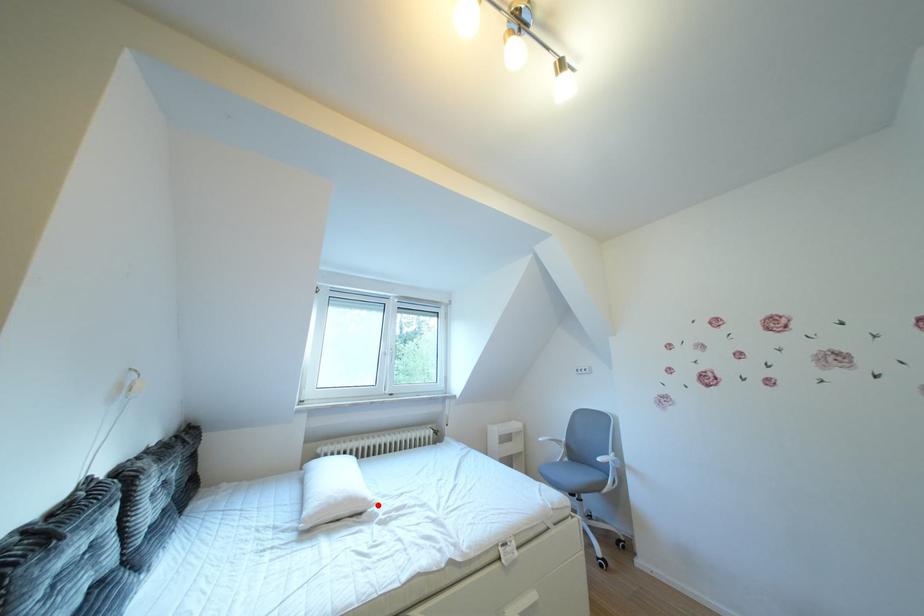
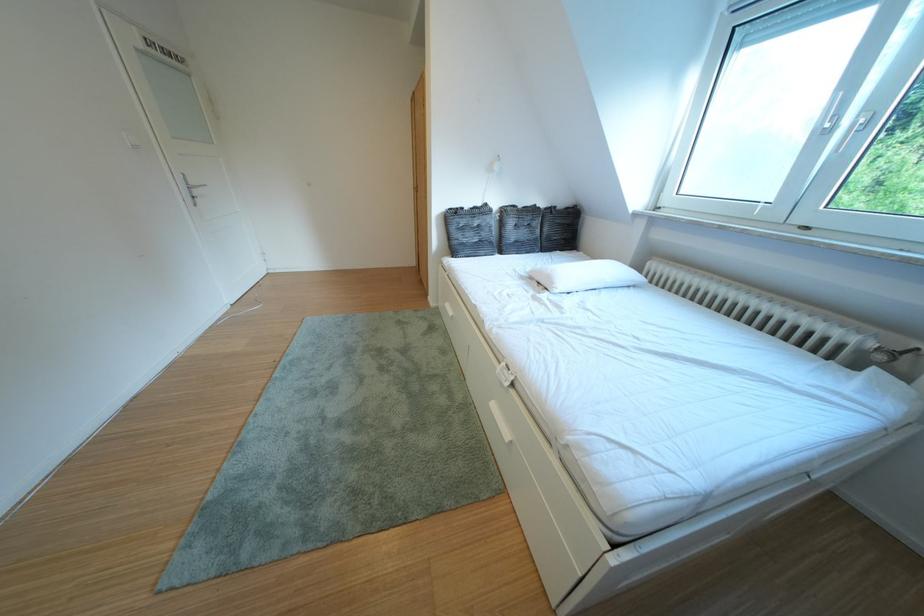
Where in the second image is the point corresponding to the highlighted location from the first image?

(565, 288)